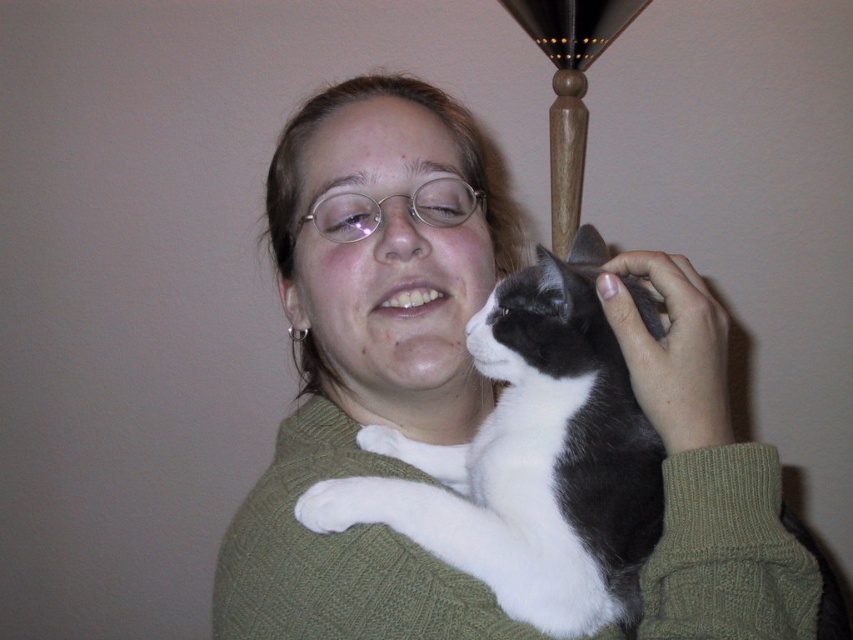
Question: Is the position of green knitted sweater at center more distant than that of white and gray fur cat at center?

Choices:
 (A) no
 (B) yes

Answer: (A)

Question: Among these objects, which one is nearest to the camera?

Choices:
 (A) white and gray fur cat at center
 (B) green knitted sweater at center

Answer: (B)

Question: Is green knitted sweater at center bigger than wooden lampshade at upper center?

Choices:
 (A) yes
 (B) no

Answer: (A)

Question: Which object is positioned farthest from the wooden lampshade at upper center?

Choices:
 (A) white and gray fur cat at center
 (B) green knitted sweater at center

Answer: (A)

Question: Is white and gray fur cat at center to the right of wooden lampshade at upper center from the viewer's perspective?

Choices:
 (A) yes
 (B) no

Answer: (B)

Question: Which object appears farthest from the camera in this image?

Choices:
 (A) white and gray fur cat at center
 (B) wooden lampshade at upper center
 (C) green knitted sweater at center

Answer: (B)